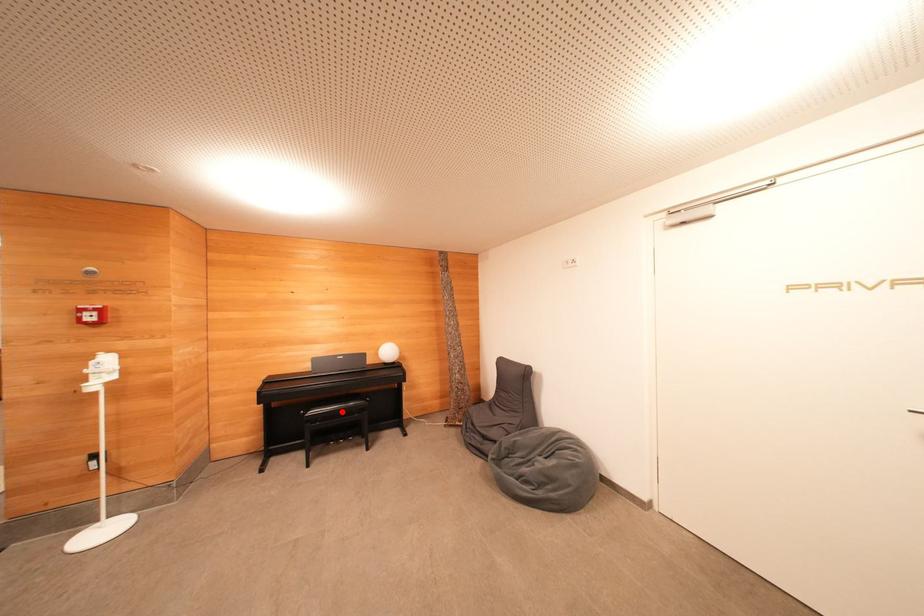
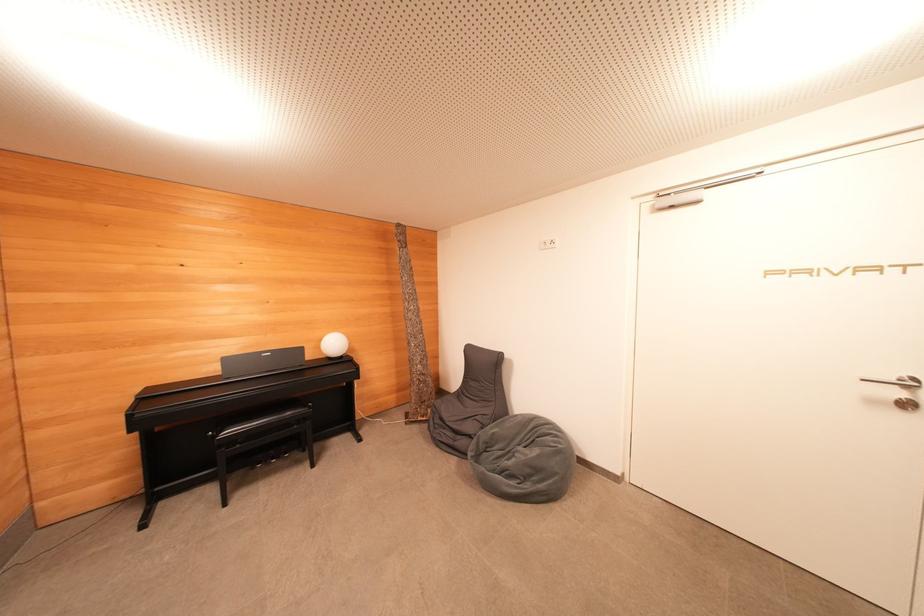
Locate, in the second image, the point that corresponds to the highlighted location in the first image.

(269, 423)